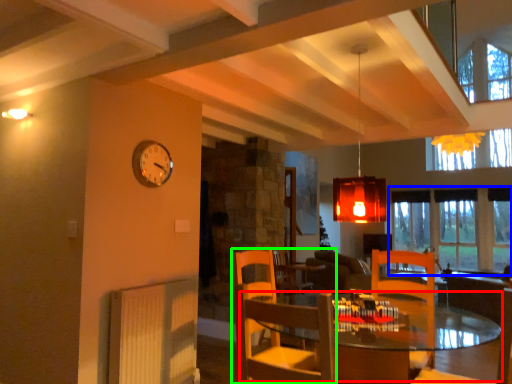
Question: Based on their relative distances, which object is nearer to table (highlighted by a red box)? Choose from window (highlighted by a blue box) and chair (highlighted by a green box).

Choices:
 (A) window
 (B) chair

Answer: (A)